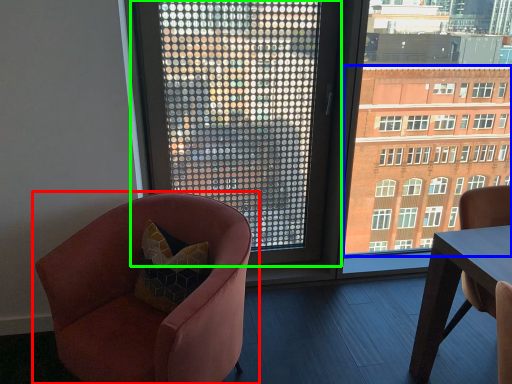
Question: Which is farther away from chair (highlighted by a red box)? condominium (highlighted by a blue box) or window (highlighted by a green box)?

Choices:
 (A) condominium
 (B) window

Answer: (A)